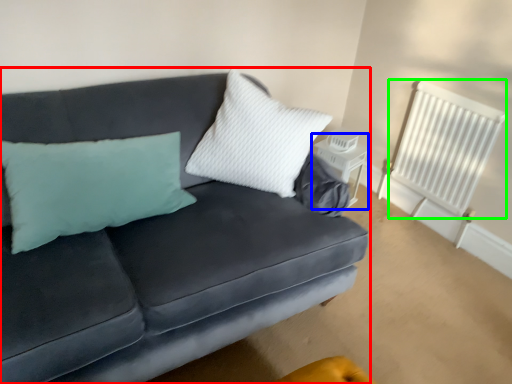
Question: Which is nearer to the studio couch (highlighted by a red box)? table (highlighted by a blue box) or radiator (highlighted by a green box).

Choices:
 (A) table
 (B) radiator

Answer: (A)